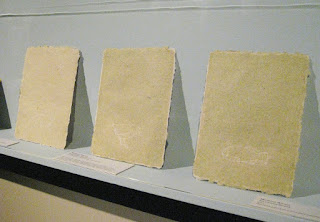
Identify the location of the front of shelf lip. The height and width of the screenshot is (222, 320). pyautogui.click(x=152, y=186).